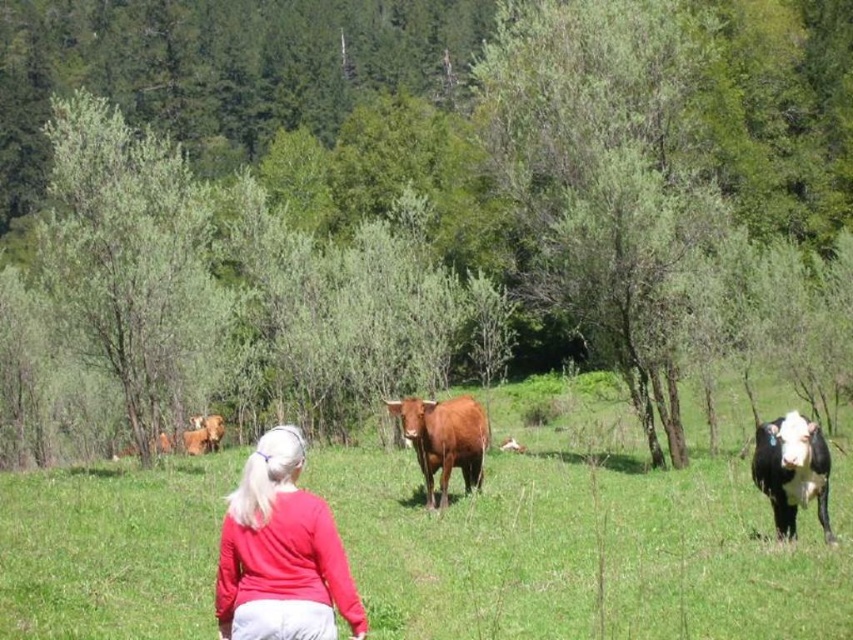
Can you confirm if black and white cow at right is smaller than brown fur cow at center?

Actually, black and white cow at right might be larger than brown fur cow at center.

Who is lower down, black and white cow at right or brown fur cow at center?

brown fur cow at center is lower down.

The width and height of the screenshot is (853, 640). What do you see at coordinates (792, 470) in the screenshot? I see `black and white cow at right` at bounding box center [792, 470].

Identify the location of black and white cow at right. (792, 470).

Between green leafy tree at center and matte red sweater at center, which one appears on the right side from the viewer's perspective?

matte red sweater at center is more to the right.

Does point (698, 115) come behind point (306, 616)?

That is True.

Image resolution: width=853 pixels, height=640 pixels. I want to click on green leafy tree at center, so pos(402,204).

Can you confirm if green leafy tree at left is positioned below matte red sweater at center?

No, green leafy tree at left is not below matte red sweater at center.

Describe the element at coordinates (126, 259) in the screenshot. I see `green leafy tree at left` at that location.

The height and width of the screenshot is (640, 853). Describe the element at coordinates (126, 259) in the screenshot. I see `green leafy tree at left` at that location.

Where is `green leafy tree at left`? This screenshot has width=853, height=640. green leafy tree at left is located at coordinates [126, 259].